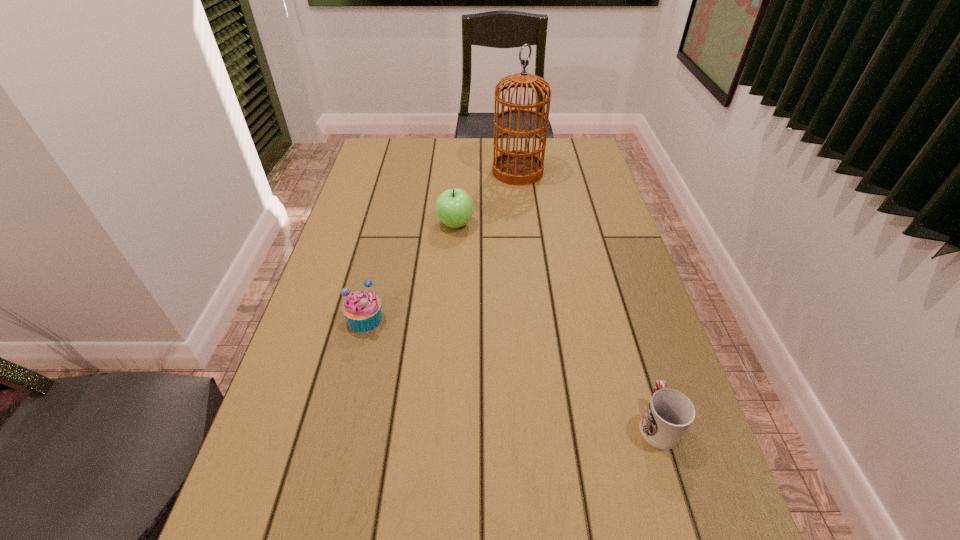
You are a GUI agent. You are given a task and a screenshot of the screen. Output one action in this format:
    pyautogui.click(x=<x>, y=<y>)
    Task: Click on the vacant space at the far right corner
    
    Given the screenshot: What is the action you would take?
    pyautogui.click(x=588, y=141)

At what (x,y) coordinates should I click in order to perform the action: click on unoccupied area between the apple and the tallest object. Please return your answer as a coordinate pair (x, y). This screenshot has height=540, width=960. Looking at the image, I should click on (487, 198).

Where is `vacant space that's between the rightmost object and the third object from right to left`? vacant space that's between the rightmost object and the third object from right to left is located at coordinates pyautogui.click(x=556, y=323).

You are a GUI agent. You are given a task and a screenshot of the screen. Output one action in this format:
    pyautogui.click(x=<x>, y=<y>)
    Task: Click on the free space between the muffin and the rightmost object
    The height and width of the screenshot is (540, 960).
    Given the screenshot: What is the action you would take?
    pyautogui.click(x=512, y=371)

Where is `free space between the muffin and the second object from right to left`? free space between the muffin and the second object from right to left is located at coordinates (442, 245).

Locate an element on the screen. This screenshot has height=540, width=960. unoccupied position between the nearest object and the muffin is located at coordinates (512, 371).

This screenshot has height=540, width=960. I want to click on vacant area that lies between the tallest object and the muffin, so click(x=442, y=245).

I want to click on vacant point located between the third farthest object and the nearest object, so click(x=512, y=371).

Where is `free space between the third farthest object and the second object from right to left`? The height and width of the screenshot is (540, 960). free space between the third farthest object and the second object from right to left is located at coordinates (442, 245).

Locate an element on the screen. vacant area between the second object from left to right and the muffin is located at coordinates (410, 272).